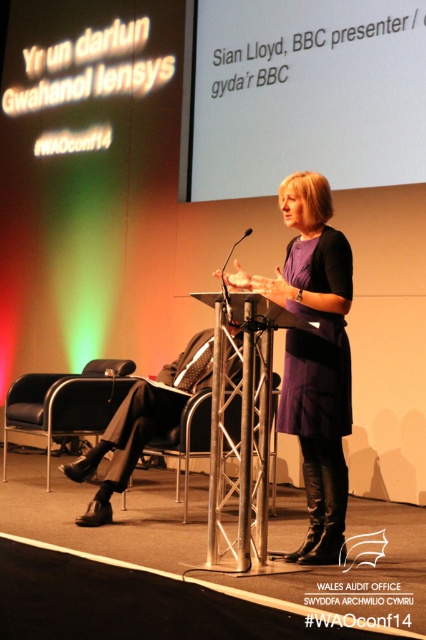
Question: Which of the following is the farthest from the observer?

Choices:
 (A) [336, 454]
 (B) [250, 531]

Answer: (A)

Question: Which object is closer to the camera taking this photo?

Choices:
 (A) black leather chair at lower left
 (B) metallic silver podium at center
 (C) purple matte dress at center
 (D) metallic silver chair at center

Answer: (B)

Question: Is black leather chair at lower left below metallic silver chair at center?

Choices:
 (A) yes
 (B) no

Answer: (B)

Question: Which point is closer to the camera?

Choices:
 (A) (305, 419)
 (B) (17, 403)

Answer: (A)

Question: Is black leather chair at lower left to the right of metallic silver chair at center from the viewer's perspective?

Choices:
 (A) yes
 (B) no

Answer: (B)

Question: Can you confirm if metallic silver podium at center is positioned to the right of metallic silver chair at center?

Choices:
 (A) yes
 (B) no

Answer: (A)